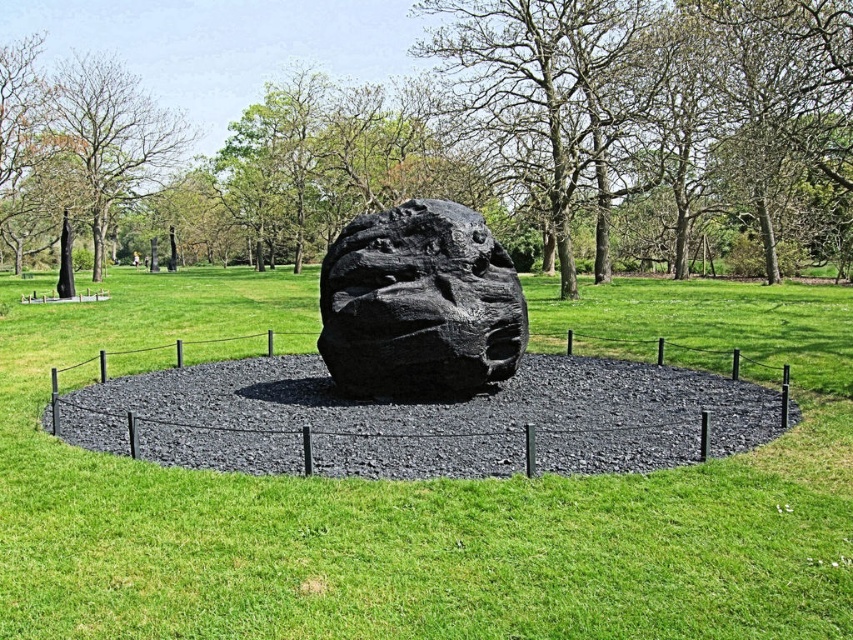
Question: Can you confirm if black gravel at center is wider than black rough stone at center?

Choices:
 (A) no
 (B) yes

Answer: (A)

Question: Based on their relative distances, which object is farther from the green leafy tree at center?

Choices:
 (A) black rough stone at center
 (B) black gravel at center

Answer: (B)

Question: Which of these objects is positioned farthest from the black gravel at center?

Choices:
 (A) green leafy tree at center
 (B) black rough stone at center

Answer: (A)

Question: Estimate the real-world distances between objects in this image. Which object is closer to the black rough stone at center?

Choices:
 (A) green leafy tree at center
 (B) black gravel at center

Answer: (B)

Question: Does green leafy tree at center appear on the right side of black rough stone at center?

Choices:
 (A) no
 (B) yes

Answer: (A)

Question: Can you confirm if green leafy tree at center is bigger than black rough stone at center?

Choices:
 (A) yes
 (B) no

Answer: (A)